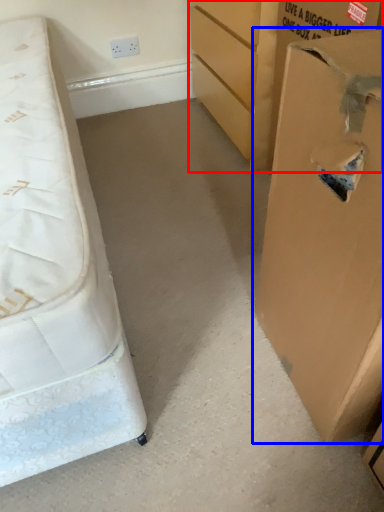
Question: Which object is closer to the camera taking this photo, cardboard box (highlighted by a red box) or cardboard box (highlighted by a blue box)?

Choices:
 (A) cardboard box
 (B) cardboard box

Answer: (B)